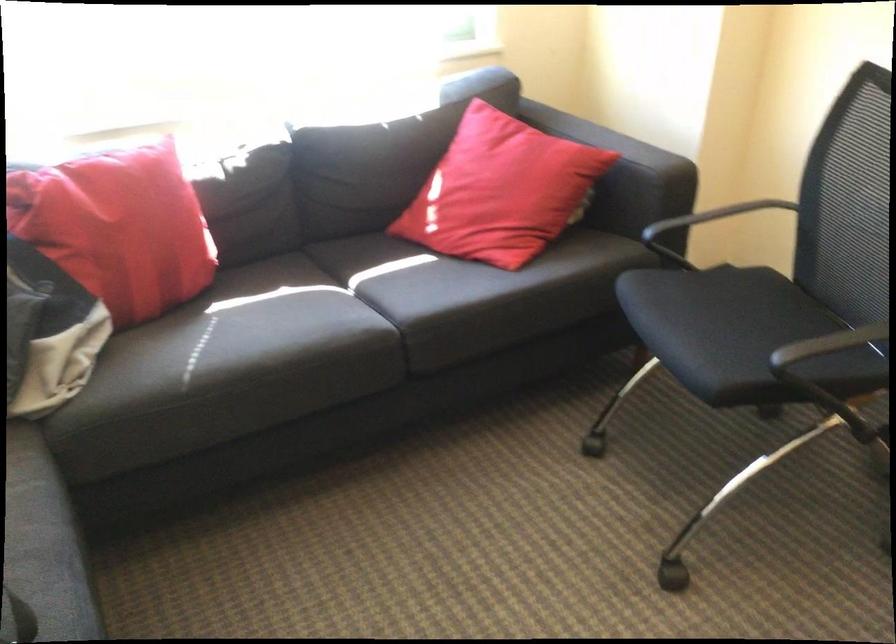
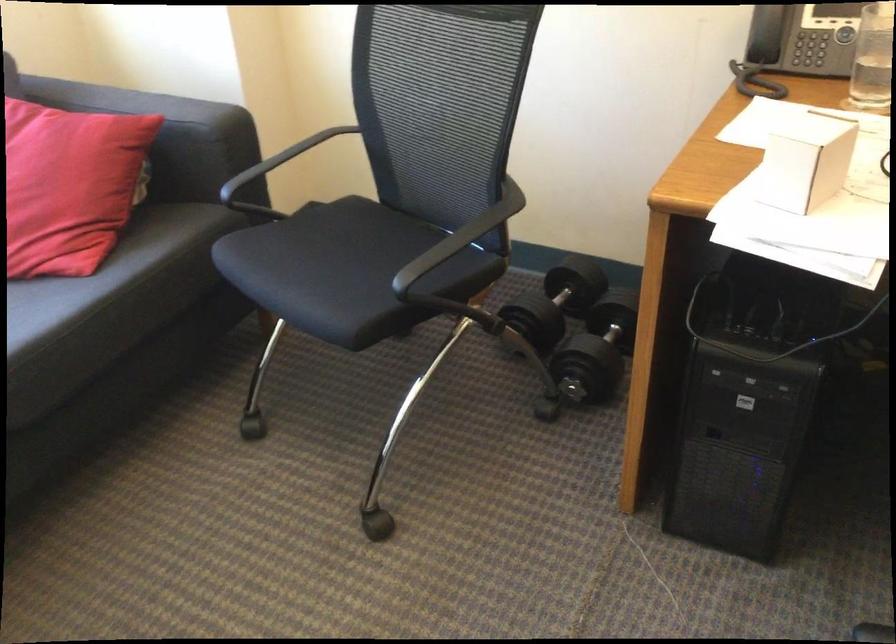
In the second image, find the point that corresponds to point (576, 247) in the first image.

(156, 230)